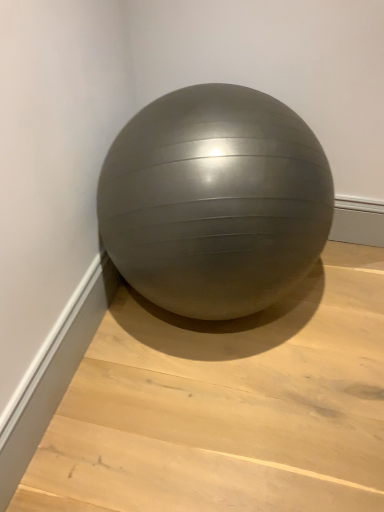
Find the location of a particular element. free spot in front of matte gray ball at center is located at coordinates (228, 428).